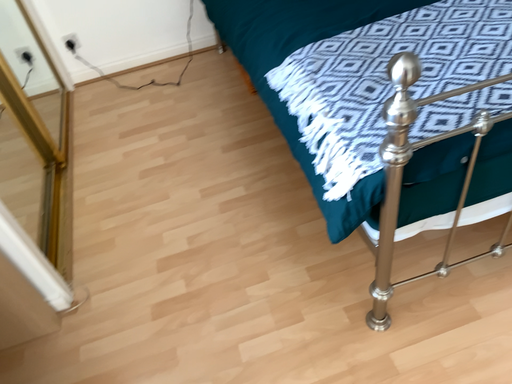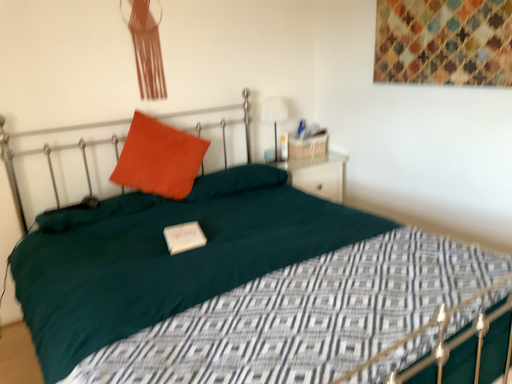
Question: Which way did the camera rotate in the video?

Choices:
 (A) rotated downward
 (B) rotated upward

Answer: (B)